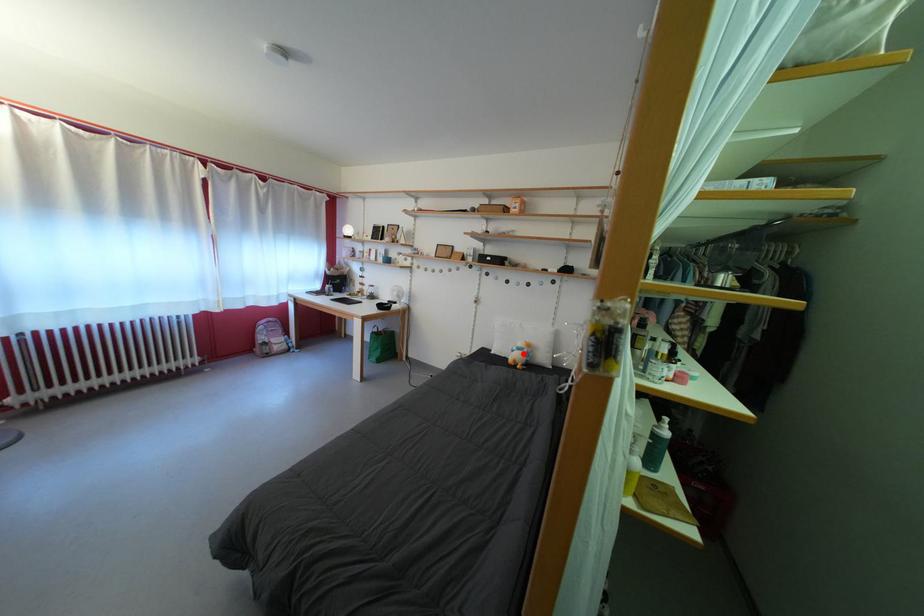
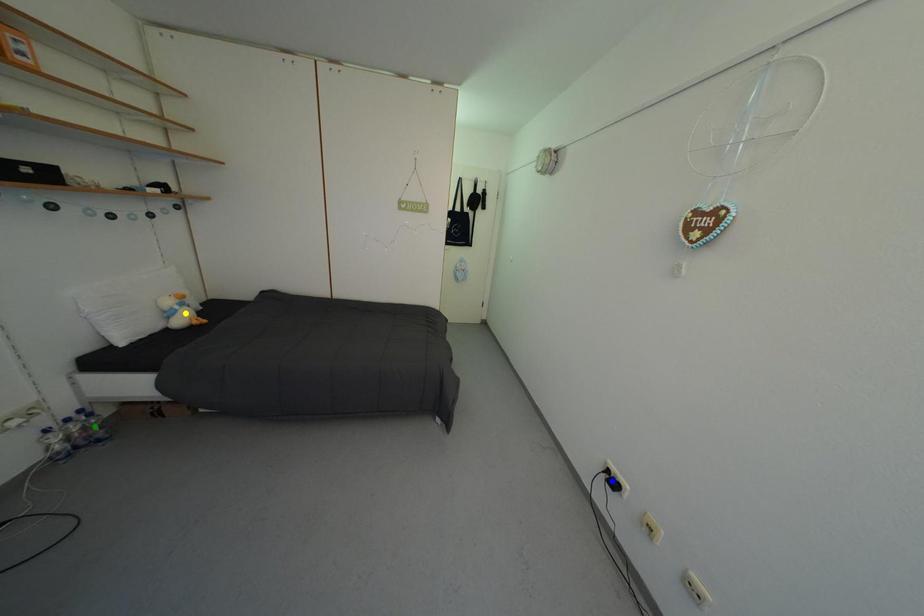
Question: I am providing you with two images of the same scene from different viewpoints. A red point is marked on the first image. You are given multiple points on the second image. In image 2, which mark is for the same physical point as the one in image 1?

Choices:
 (A) green point
 (B) yellow point
 (C) blue point

Answer: (B)